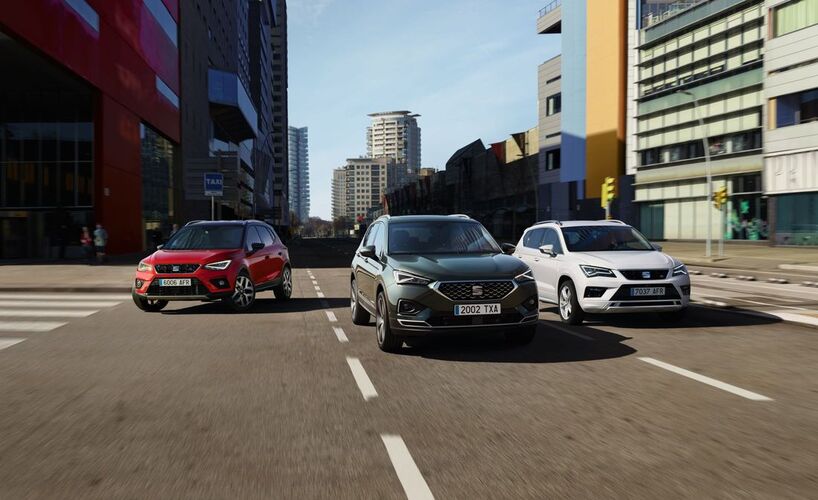
Identify the location of door handles. This screenshot has height=500, width=818. (267, 257), (281, 253), (366, 261), (357, 255), (536, 260), (519, 257).